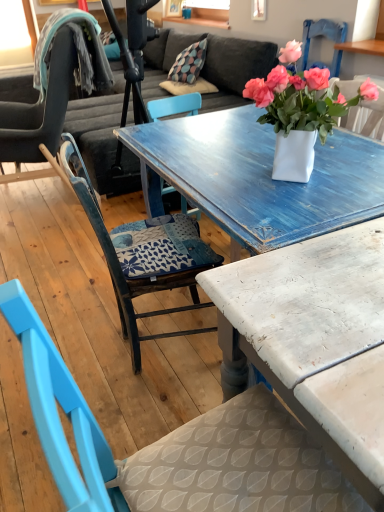
Where is `blue painted wood chair at center, acting as the third chair starting from the left`? The height and width of the screenshot is (512, 384). blue painted wood chair at center, acting as the third chair starting from the left is located at coordinates (174, 446).

Measure the distance between point (229, 280) and camera.

The distance of point (229, 280) from camera is 34.80 inches.

Find the location of a particular element. The height and width of the screenshot is (512, 384). matte blue chair at left, which is counted as the 3th chair, starting from the front is located at coordinates (42, 104).

Describe the element at coordinates (143, 254) in the screenshot. I see `blue painted wood chair at center, acting as the 2th chair starting from the front` at that location.

Where is `blue painted wood chair at center, the second chair viewed from the left`? blue painted wood chair at center, the second chair viewed from the left is located at coordinates (143, 254).

At what (x,y) coordinates should I click in order to perform the action: click on white matte vase at center. Please return your answer as a coordinate pair (x, y). Image resolution: width=384 pixels, height=512 pixels. Looking at the image, I should click on (302, 96).

Consider the image. Would you say blue painted wood chair at center, placed as the second chair when sorted from back to front, is inside or outside blue painted wood chair at center, acting as the third chair starting from the left?

blue painted wood chair at center, placed as the second chair when sorted from back to front, is located beyond the bounds of blue painted wood chair at center, acting as the third chair starting from the left.

From the image's perspective, is blue painted wood chair at center, which ranks as the second chair in right-to-left order, below blue painted wood chair at center, which is counted as the 1th chair, starting from the right?

No, from the image's perspective, blue painted wood chair at center, which ranks as the second chair in right-to-left order, is not below blue painted wood chair at center, which is counted as the 1th chair, starting from the right.

Considering the sizes of objects blue painted wood chair at center, acting as the 2th chair starting from the front, and blue painted wood chair at center, which is counted as the 1th chair, starting from the right, in the image provided, who is shorter, blue painted wood chair at center, acting as the 2th chair starting from the front, or blue painted wood chair at center, which is counted as the 1th chair, starting from the right,?

Standing shorter between the two is blue painted wood chair at center, acting as the 2th chair starting from the front.

I want to click on chair located in front of the blue painted wood chair at center, which ranks as the second chair in right-to-left order, so click(174, 446).

Is blue painted wood chair at center, positioned as the 3th chair in back-to-front order, looking in the opposite direction of matte blue chair at left, marked as the 3th chair in a right-to-left arrangement?

No.

From a real-world perspective, which is physically below, blue painted wood chair at center, positioned as the 3th chair in back-to-front order, or matte blue chair at left, the first chair viewed from the back?

In real-world perspective, blue painted wood chair at center, positioned as the 3th chair in back-to-front order, is lower.

Does point (318, 489) appear closer or farther from the camera than point (68, 59)?

Point (318, 489) appears to be closer to the viewer than point (68, 59).

Does blue painted wood chair at center, which is counted as the 1th chair, starting from the front, have a greater width compared to matte blue chair at left, which appears as the 1th chair when viewed from the left?

In fact, blue painted wood chair at center, which is counted as the 1th chair, starting from the front, might be narrower than matte blue chair at left, which appears as the 1th chair when viewed from the left.

From their relative heights in the image, would you say distressed white table at center is taller or shorter than matte blue chair at left, the first chair viewed from the back?

Clearly, distressed white table at center is shorter compared to matte blue chair at left, the first chair viewed from the back.

Which is in front, distressed white table at center or matte blue chair at left, marked as the 3th chair in a right-to-left arrangement?

distressed white table at center is in front.

Based on the photo, from a real-world perspective, does distressed white table at center stand above matte blue chair at left, which is counted as the 3th chair, starting from the front?

No, from a real-world perspective, distressed white table at center is not above matte blue chair at left, which is counted as the 3th chair, starting from the front.

From the image's perspective, between distressed white table at center and matte blue chair at left, which is counted as the 3th chair, starting from the front, which one is located above?

matte blue chair at left, which is counted as the 3th chair, starting from the front, from the image's perspective.

Would you say blue painted wood chair at center, which is counted as the 1th chair, starting from the right, is outside white matte vase at center?

That's correct, blue painted wood chair at center, which is counted as the 1th chair, starting from the right, is outside of white matte vase at center.

Which of these two, blue painted wood chair at center, which is counted as the 1th chair, starting from the front, or white matte vase at center, is smaller?

With smaller size is white matte vase at center.

At what (x,y) coordinates should I click in order to perform the action: click on flower that is above the blue painted wood chair at center, which is counted as the 1th chair, starting from the right (from the image's perspective). Please return your answer as a coordinate pair (x, y). Looking at the image, I should click on (302, 96).

From the image's perspective, which one is positioned lower, white matte vase at center or blue painted wood chair at center, which is counted as the 1th chair, starting from the right?

From the image's view, blue painted wood chair at center, which is counted as the 1th chair, starting from the right, is below.

Is white matte vase at center to the left of blue painted wood chair at center, acting as the third chair starting from the left, from the viewer's perspective?

No.

Who is taller, white matte vase at center or blue painted wood chair at center, which is counted as the 1th chair, starting from the front?

blue painted wood chair at center, which is counted as the 1th chair, starting from the front.

Could you measure the distance between white matte vase at center and blue painted wood chair at center, which is counted as the 1th chair, starting from the right?

white matte vase at center and blue painted wood chair at center, which is counted as the 1th chair, starting from the right, are 34.45 inches apart from each other.

Considering the sizes of white matte vase at center and blue painted wood chair at center, placed as the second chair when sorted from back to front, in the image, is white matte vase at center taller or shorter than blue painted wood chair at center, placed as the second chair when sorted from back to front,?

Clearly, white matte vase at center is shorter compared to blue painted wood chair at center, placed as the second chair when sorted from back to front.

Is white matte vase at center wider than blue painted wood chair at center, the second chair viewed from the left?

No.

From a real-world perspective, who is located lower, white matte vase at center or blue painted wood chair at center, which ranks as the second chair in right-to-left order?

blue painted wood chair at center, which ranks as the second chair in right-to-left order.

Is blue painted wood chair at center, acting as the 2th chair starting from the front, at the back of white matte vase at center?

No, white matte vase at center's orientation is not away from blue painted wood chair at center, acting as the 2th chair starting from the front.

In terms of size, does matte blue chair at left, marked as the 3th chair in a right-to-left arrangement, appear bigger or smaller than white matte vase at center?

Considering their sizes, matte blue chair at left, marked as the 3th chair in a right-to-left arrangement, takes up more space than white matte vase at center.

Which object is further away from the camera taking this photo, matte blue chair at left, marked as the 3th chair in a right-to-left arrangement, or white matte vase at center?

matte blue chair at left, marked as the 3th chair in a right-to-left arrangement, is further away from the camera.

How far apart are matte blue chair at left, the first chair viewed from the back, and white matte vase at center?

matte blue chair at left, the first chair viewed from the back, and white matte vase at center are 1.81 meters apart.

Identify the location of chair that is the 1st object located behind the blue painted wood chair at center, which is counted as the 1th chair, starting from the front. The image size is (384, 512). (143, 254).

The height and width of the screenshot is (512, 384). Identify the location of chair that is the 2nd object to the right of the matte blue chair at left, which is counted as the 3th chair, starting from the front, starting at the anchor. click(x=174, y=446).

In the scene shown: When comparing their distances from distressed white table at center, does matte blue chair at left, the first chair viewed from the back, or blue painted wood chair at center, which ranks as the second chair in right-to-left order, seem closer?

blue painted wood chair at center, which ranks as the second chair in right-to-left order, is closer to distressed white table at center.

Based on their spatial positions, is blue painted wood chair at center, acting as the 2th chair starting from the front, or matte blue chair at left, which appears as the 1th chair when viewed from the left, closer to white matte vase at center?

blue painted wood chair at center, acting as the 2th chair starting from the front, is positioned closer to the anchor white matte vase at center.

Based on their spatial positions, is blue painted wood chair at center, which is counted as the 1th chair, starting from the front, or blue painted wood chair at center, acting as the 2th chair starting from the front, closer to matte blue chair at left, marked as the 3th chair in a right-to-left arrangement?

blue painted wood chair at center, acting as the 2th chair starting from the front.

From the image, which object appears to be farther from distressed white table at center, white matte vase at center or blue painted wood chair at center, the second chair viewed from the left?

Based on the image, blue painted wood chair at center, the second chair viewed from the left, appears to be further to distressed white table at center.

Based on their spatial positions, is blue painted wood chair at center, which ranks as the second chair in right-to-left order, or distressed white table at center further from white matte vase at center?

blue painted wood chair at center, which ranks as the second chair in right-to-left order, is positioned further to the anchor white matte vase at center.

Estimate the real-world distances between objects in this image. Which object is further from blue painted wood chair at center, which ranks as the second chair in right-to-left order, matte blue chair at left, marked as the 3th chair in a right-to-left arrangement, or distressed white table at center?

matte blue chair at left, marked as the 3th chair in a right-to-left arrangement, is positioned further to the anchor blue painted wood chair at center, which ranks as the second chair in right-to-left order.

Estimate the real-world distances between objects in this image. Which object is closer to blue painted wood chair at center, which is counted as the 1th chair, starting from the front, white matte vase at center or distressed white table at center?

distressed white table at center is closer to blue painted wood chair at center, which is counted as the 1th chair, starting from the front.

Looking at the image, which one is located closer to distressed white table at center, white matte vase at center or blue painted wood chair at center, which is counted as the 1th chair, starting from the front?

blue painted wood chair at center, which is counted as the 1th chair, starting from the front, lies closer to distressed white table at center than the other object.

Find the location of a particular element. This screenshot has height=512, width=384. flower between blue painted wood chair at center, which is counted as the 1th chair, starting from the front, and blue painted wood chair at center, placed as the second chair when sorted from back to front, from front to back is located at coordinates (302, 96).

In order to click on flower between blue painted wood chair at center, positioned as the 3th chair in back-to-front order, and matte blue chair at left, the first chair viewed from the back, from front to back in this screenshot , I will do `click(302, 96)`.

This screenshot has width=384, height=512. I want to click on chair located between distressed white table at center and matte blue chair at left, which appears as the 1th chair when viewed from the left, in the depth direction, so click(143, 254).

Identify the location of chair between white matte vase at center and distressed white table at center from top to bottom. The width and height of the screenshot is (384, 512). (143, 254).